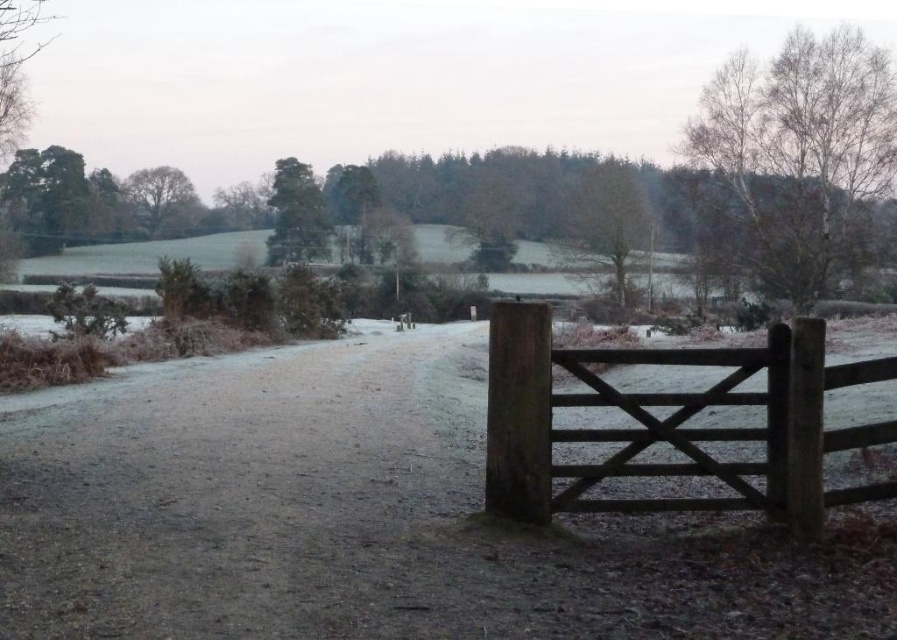
Can you confirm if bare birch tree at upper right is bigger than green leafy tree at upper left?

Correct, bare birch tree at upper right is larger in size than green leafy tree at upper left.

Does bare birch tree at upper right appear over green leafy tree at upper left?

Correct, bare birch tree at upper right is located above green leafy tree at upper left.

Does point (774, 273) lie behind point (128, 188)?

No, it is in front of (128, 188).

What are the coordinates of `bare birch tree at upper right` in the screenshot? It's located at (800, 156).

The height and width of the screenshot is (640, 897). What do you see at coordinates (231, 500) in the screenshot?
I see `frosted gravel path at center` at bounding box center [231, 500].

Is frosted gravel path at center below wooden gate at right?

Correct, frosted gravel path at center is located below wooden gate at right.

Locate an element on the screen. frosted gravel path at center is located at coordinates (231, 500).

Between wooden gate at right and green textured tree at upper center, which one appears on the right side from the viewer's perspective?

From the viewer's perspective, wooden gate at right appears more on the right side.

The height and width of the screenshot is (640, 897). Identify the location of wooden gate at right. (669, 422).